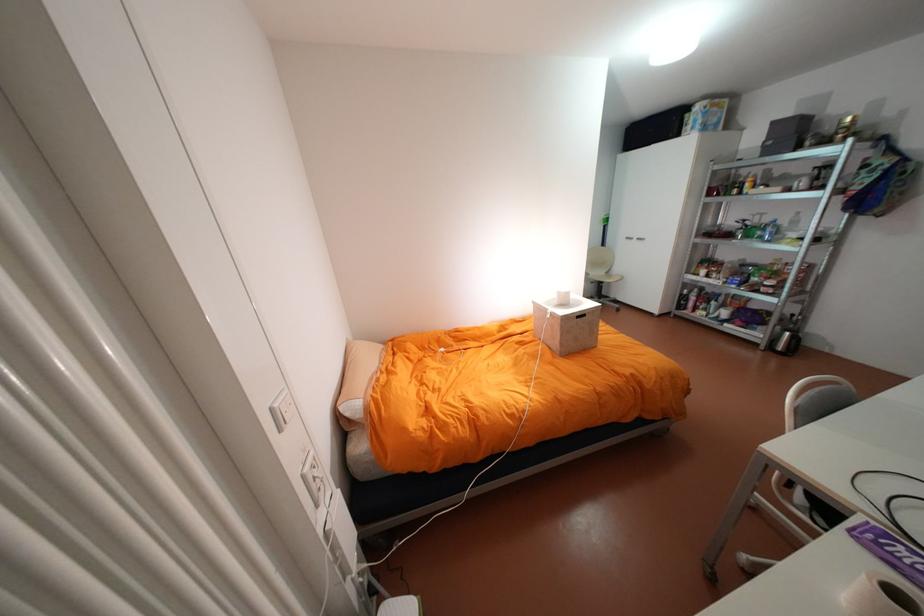
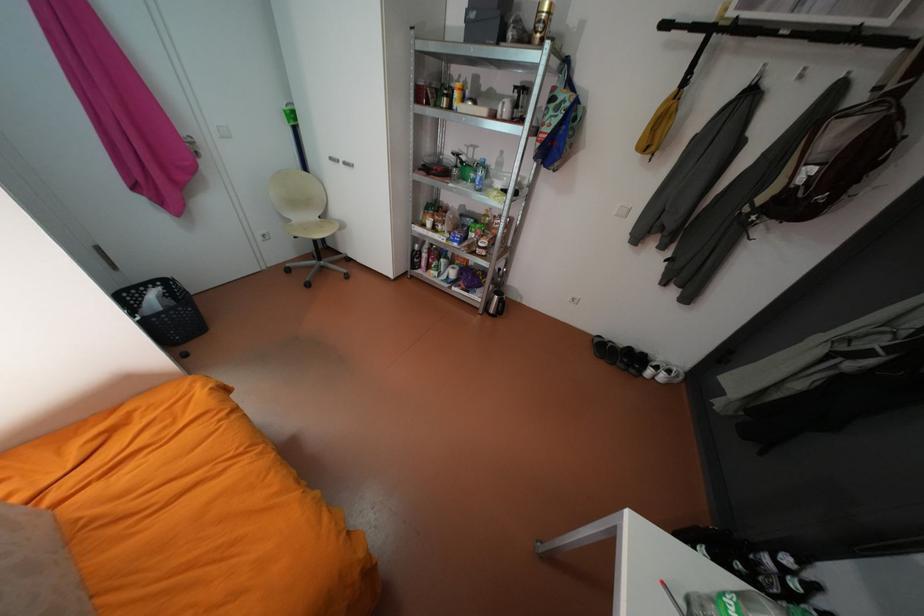
Locate, in the second image, the point that corresponds to point (767, 344) in the first image.

(487, 308)